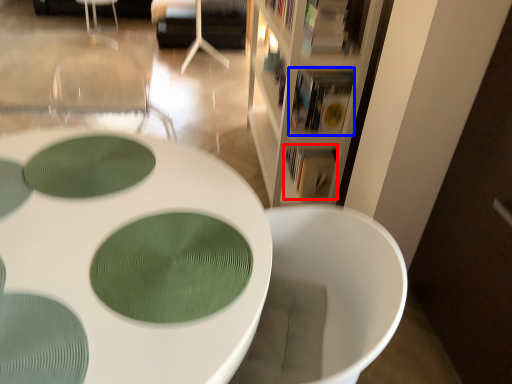
Question: Which object is further to the camera taking this photo, book (highlighted by a red box) or book (highlighted by a blue box)?

Choices:
 (A) book
 (B) book

Answer: (A)